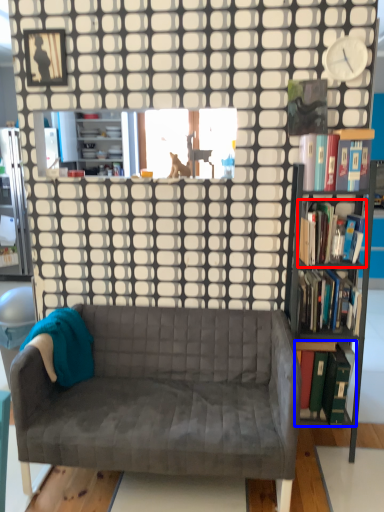
Question: Which point is further to the camera, book (highlighted by a red box) or book (highlighted by a blue box)?

Choices:
 (A) book
 (B) book

Answer: (B)